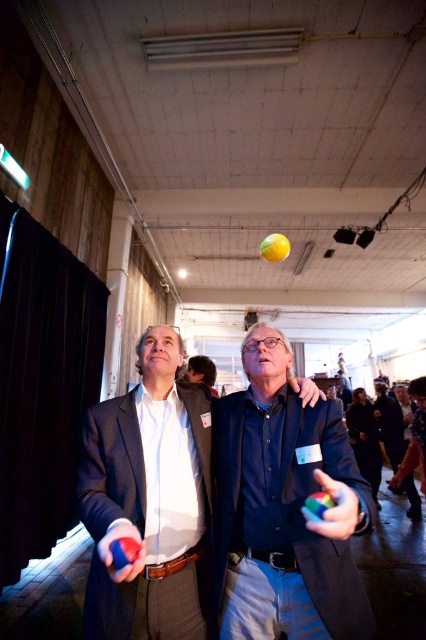
Question: Is white shirt at center above smooth brown leather jacket at center?

Choices:
 (A) yes
 (B) no

Answer: (B)

Question: Which of the following is the farthest from the observer?

Choices:
 (A) (203, 406)
 (B) (204, 371)

Answer: (B)

Question: Does matte black jacket at center come in front of white shirt at center?

Choices:
 (A) yes
 (B) no

Answer: (A)

Question: Which object is closer to the camera taking this photo?

Choices:
 (A) matte black jacket at center
 (B) white shirt at center
 (C) smooth brown leather jacket at center

Answer: (A)

Question: Considering the real-world distances, which object is farthest from the smooth brown leather jacket at center?

Choices:
 (A) white shirt at center
 (B) matte black suit at left
 (C) matte black jacket at center

Answer: (C)

Question: Can you confirm if white shirt at center is positioned to the left of matte black suit at left?

Choices:
 (A) no
 (B) yes

Answer: (B)